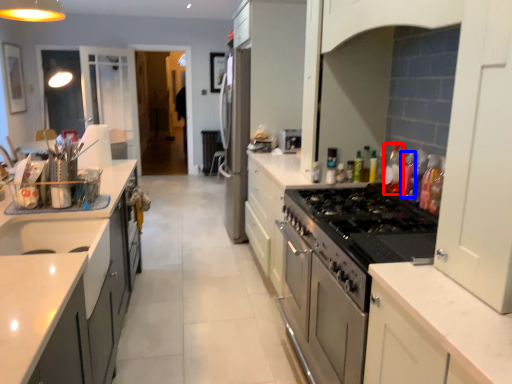
Question: Which object is closer to the camera taking this photo, bottle (highlighted by a red box) or bottle (highlighted by a blue box)?

Choices:
 (A) bottle
 (B) bottle

Answer: (B)